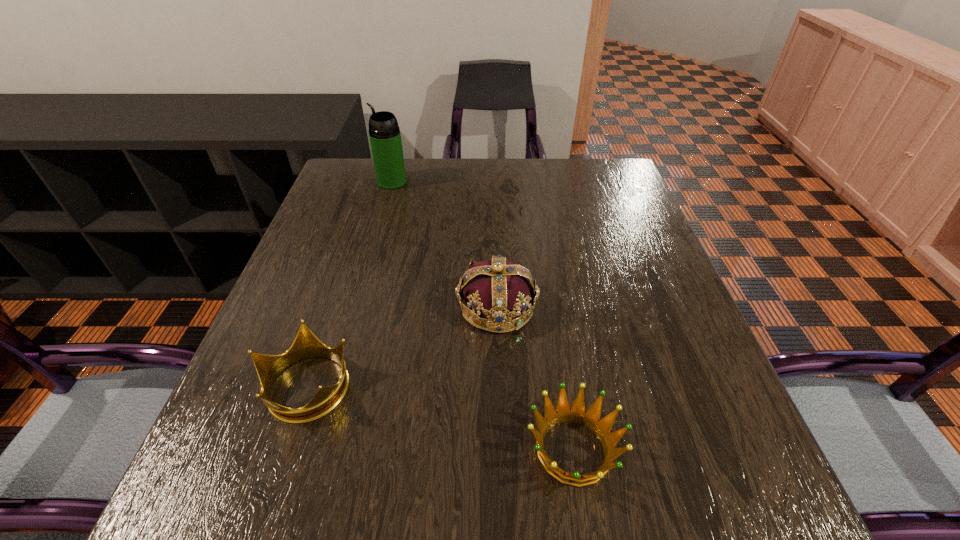
What are the coordinates of `vacant space at the left edge of the desktop` in the screenshot? It's located at (244, 378).

Find the location of a particular element. Image resolution: width=960 pixels, height=540 pixels. vacant space at the right edge of the desktop is located at coordinates (636, 230).

Where is `vacant area at the far right corner`? This screenshot has height=540, width=960. vacant area at the far right corner is located at coordinates (618, 172).

At what (x,y) coordinates should I click in order to perform the action: click on free spot between the shortest crown and the second shortest crown. Please return your answer as a coordinate pair (x, y). The image size is (960, 540). Looking at the image, I should click on (440, 417).

Where is `free space between the thermos bottle and the leftmost crown`? free space between the thermos bottle and the leftmost crown is located at coordinates (349, 284).

The height and width of the screenshot is (540, 960). In order to click on vacant point located between the third tallest object and the shortest object in this screenshot , I will do `click(440, 417)`.

At what (x,y) coordinates should I click in order to perform the action: click on vacant area that lies between the thermos bottle and the second farthest object. Please return your answer as a coordinate pair (x, y). The height and width of the screenshot is (540, 960). Looking at the image, I should click on (444, 244).

This screenshot has height=540, width=960. Find the location of `blank region between the leftmost crown and the thermos bottle`. blank region between the leftmost crown and the thermos bottle is located at coordinates (349, 284).

Find the location of a particular element. This screenshot has height=540, width=960. vacant point located between the shortest crown and the leftmost crown is located at coordinates (440, 417).

Locate an element on the screen. The height and width of the screenshot is (540, 960). free point between the tallest crown and the shortest crown is located at coordinates (535, 378).